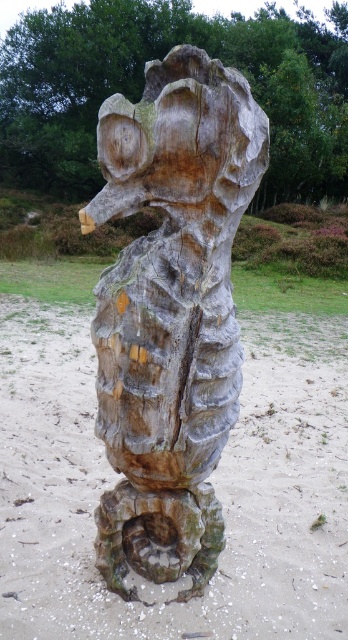
Can you confirm if brown wood at center is bigger than weathered wood sculpture at center?

Incorrect, brown wood at center is not larger than weathered wood sculpture at center.

Between point (87, 545) and point (165, 376), which one is positioned behind?

The point (87, 545) is more distant.

You are a GUI agent. You are given a task and a screenshot of the screen. Output one action in this format:
    pyautogui.click(x=<x>, y=<y>)
    Task: Click on the brown wood at center
    This screenshot has height=640, width=348.
    Given the screenshot: What is the action you would take?
    pyautogui.click(x=209, y=480)